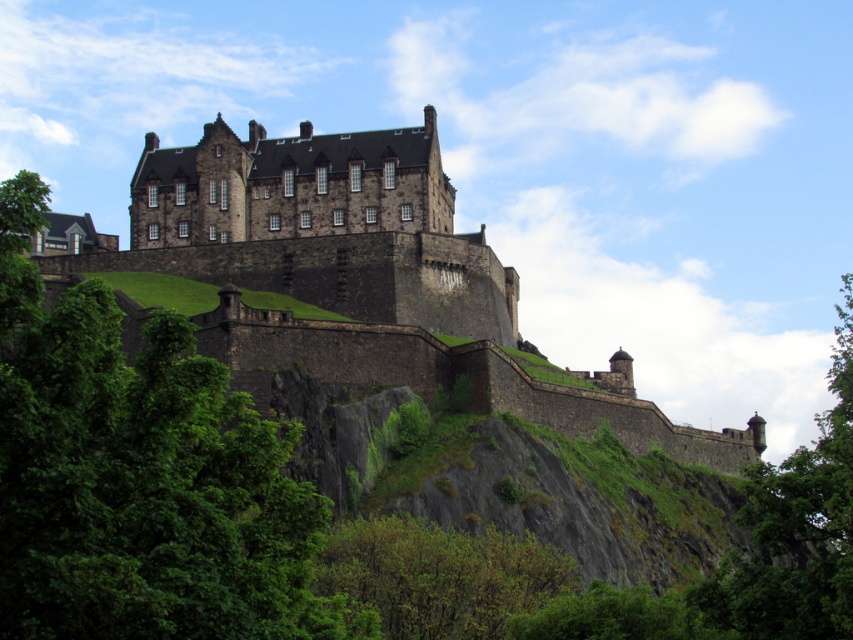
You are a tourist standing at the base of Edinburgh Castle hill. You notice a green leafy tree at upper center and a dark stone castle at center. Which object is closer to you, the tourist?

The green leafy tree at upper center is closer to you because it is positioned in front of the dark stone castle at center.